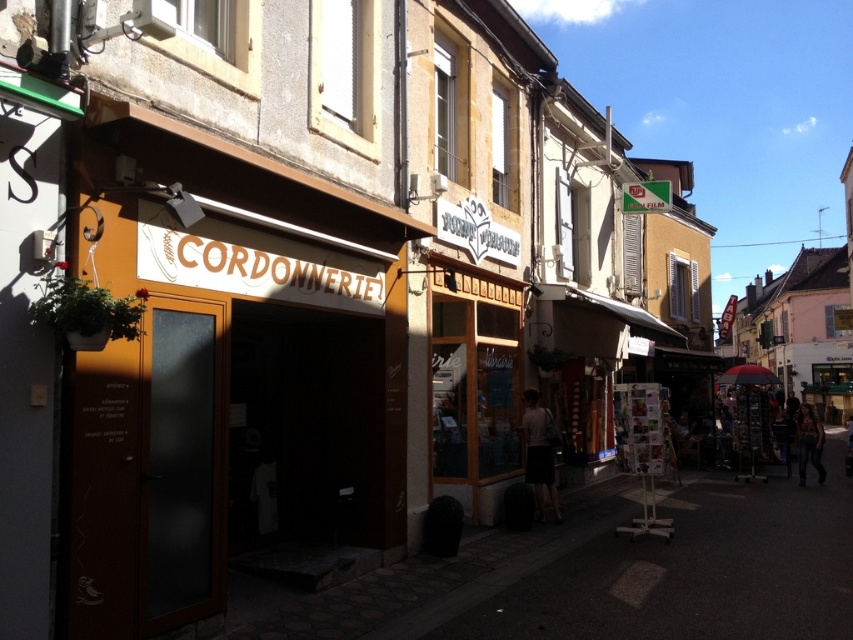
You are a tourist standing on the street and want to find the shop with the matte orange signboard at center. Based on the scene description, where should you look relative to the CORDONNERIE shop?

The matte orange signboard at center is located at coordinates (227, 372), which is to the right of the CORDONNERIE shop on the left side of the street.

You are a delivery person who needs to place a package on the street. The package is 1.2 meters wide. You see a matte orange signboard at center and denim jeans at lower right. Which object can the package be placed next to without exceeding its width?

The package can be placed next to the denim jeans at lower right because the matte orange signboard at center has a lesser width compared to denim jeans at lower right, meaning the denim jeans at lower right is wider and can accommodate the package.

You are standing on the street looking at the CORDONNERIE shop and the white cotton shirt at center. Which object is closer to you?

The white cotton shirt at center is 10.50 meters away from the viewer, so it is closer than the CORDONNERIE shop which is further away.